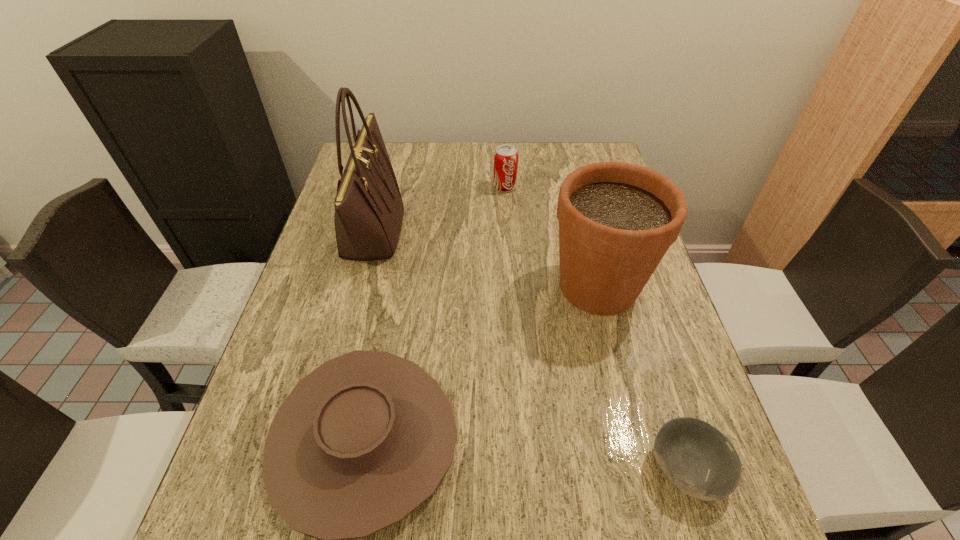
The image size is (960, 540). In order to click on object situated at the left edge in this screenshot , I will do `click(369, 210)`.

Find the location of a particular element. Image resolution: width=960 pixels, height=540 pixels. flowerpot that is positioned at the right edge is located at coordinates (617, 220).

Identify the location of bowl at the right edge. (699, 460).

Locate an element on the screen. This screenshot has height=540, width=960. vacant space at the far edge of the desktop is located at coordinates tap(489, 170).

In the image, there is a desktop. Where is `vacant space at the left edge`? This screenshot has height=540, width=960. vacant space at the left edge is located at coordinates (328, 247).

Where is `vacant space at the right edge of the desktop`? The image size is (960, 540). vacant space at the right edge of the desktop is located at coordinates click(656, 313).

Identify the location of vacant space that's between the flowerpot and the soda can. (551, 237).

Where is `empty location between the third object from right to left and the flowerpot`? Image resolution: width=960 pixels, height=540 pixels. empty location between the third object from right to left and the flowerpot is located at coordinates 551,237.

Identify the location of free spot between the tallest object and the second tallest object. The height and width of the screenshot is (540, 960). (485, 259).

Locate an element on the screen. The height and width of the screenshot is (540, 960). vacant point located between the bowl and the tallest object is located at coordinates (530, 349).